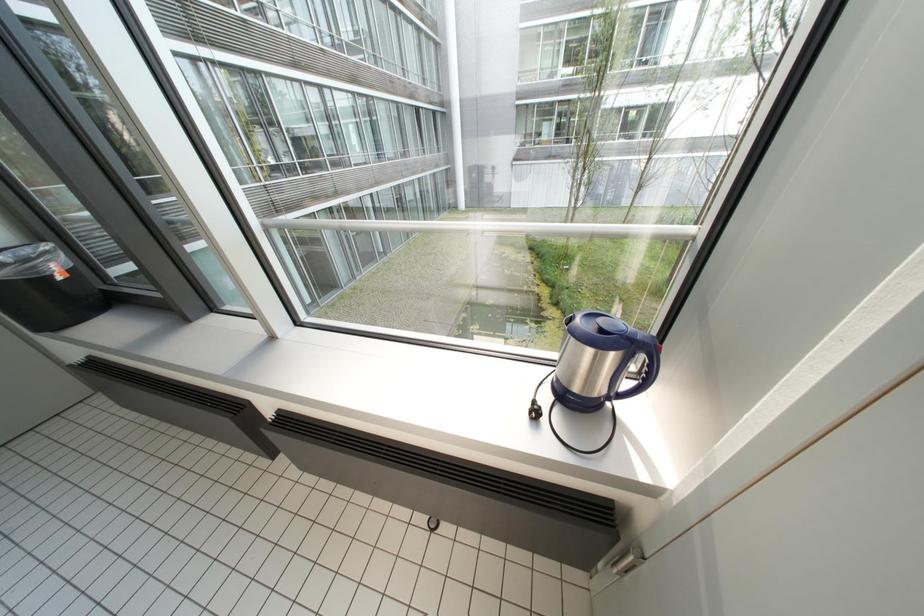
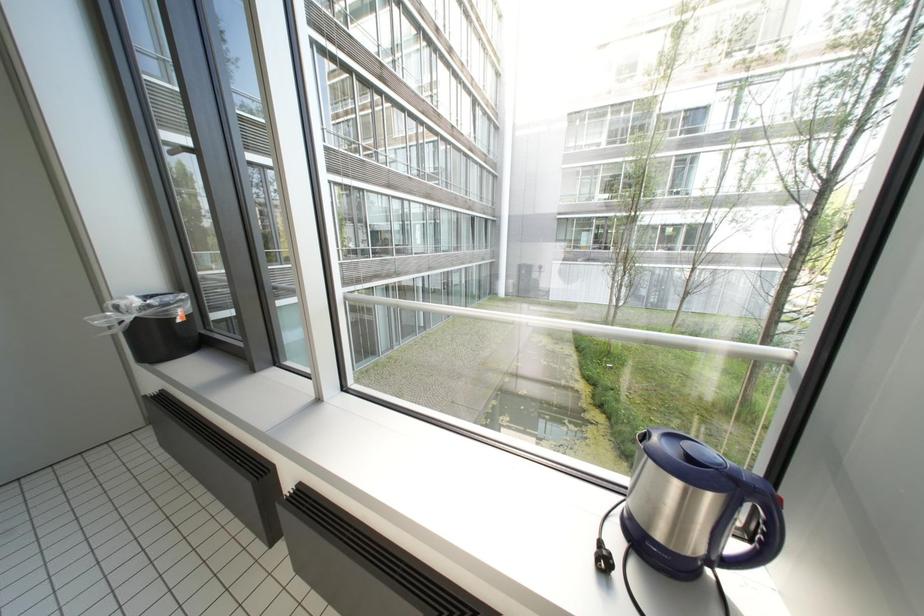
Question: Based on the continuous images, in which direction is the camera rotating? Reply with the corresponding letter.

Choices:
 (A) Left
 (B) Right
 (C) Up
 (D) Down

Answer: (C)